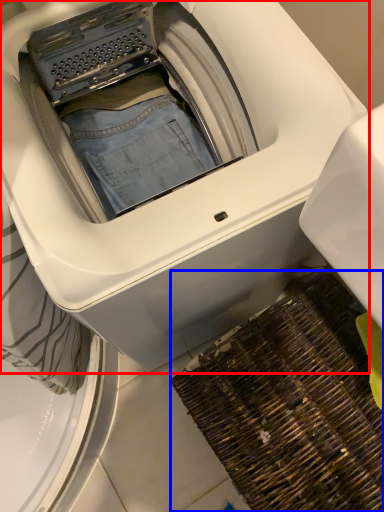
Question: Which point is closer to the camera, washing machine (highlighted by a red box) or doormat (highlighted by a blue box)?

Choices:
 (A) washing machine
 (B) doormat

Answer: (A)